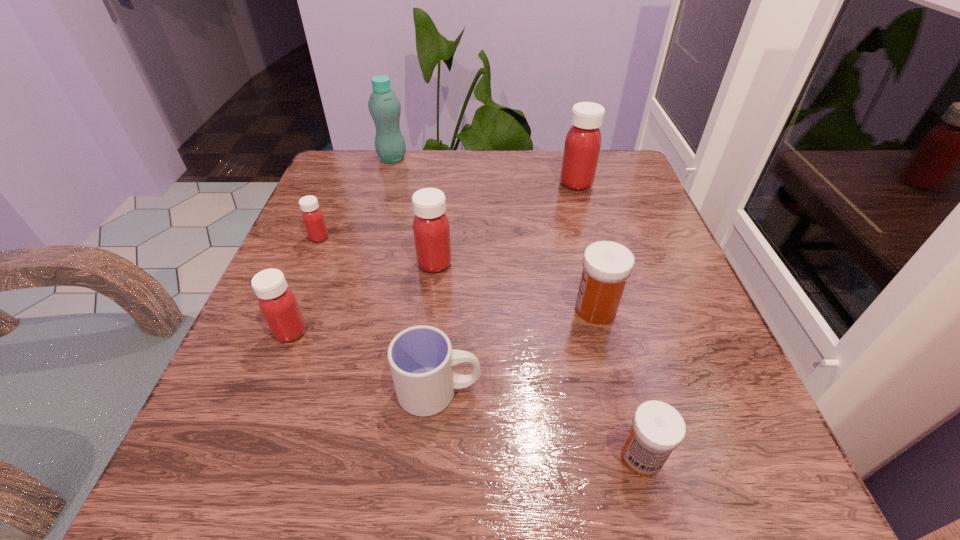
Locate an element on the screen. Image resolution: width=960 pixels, height=540 pixels. vacant space at the left edge of the desktop is located at coordinates (348, 245).

At what (x,y) coordinates should I click in order to perform the action: click on free space at the right edge of the desktop. Please return your answer as a coordinate pair (x, y). The image size is (960, 540). Looking at the image, I should click on (738, 388).

Find the location of a particular element. The width and height of the screenshot is (960, 540). vacant space at the near left corner of the desktop is located at coordinates (298, 490).

You are a GUI agent. You are given a task and a screenshot of the screen. Output one action in this format:
    pyautogui.click(x=<x>, y=<y>)
    Task: Click on the vacant region at the far right corner of the desktop
    
    Given the screenshot: What is the action you would take?
    pyautogui.click(x=623, y=151)

Locate an element on the screen. This screenshot has height=540, width=960. free spot at the near right corner of the desktop is located at coordinates (694, 464).

The image size is (960, 540). In order to click on free space between the nearest medicine and the third object from left to right in this screenshot , I will do tap(516, 308).

Image resolution: width=960 pixels, height=540 pixels. Find the location of `free space between the smallest red medicine and the fourth farthest object`. free space between the smallest red medicine and the fourth farthest object is located at coordinates (377, 251).

The image size is (960, 540). I want to click on vacant space in between the third farthest red medicine and the nearest medicine, so click(538, 360).

Where is `free space between the third object from left to right and the farthest red medicine`? The width and height of the screenshot is (960, 540). free space between the third object from left to right and the farthest red medicine is located at coordinates (484, 171).

What are the coordinates of `vacant point located between the nearer white medicine and the water bottle` in the screenshot? It's located at (516, 308).